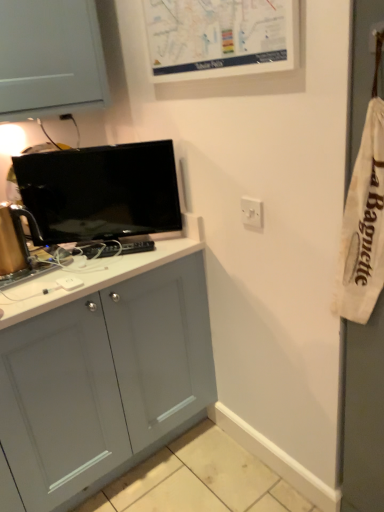
This screenshot has height=512, width=384. Identify the location of white matte map at upper center. (220, 37).

Which of these two, white plastic switch at upper right or matte black tv at upper left, stands shorter?

white plastic switch at upper right is shorter.

From the image's perspective, between white plastic switch at upper right and matte black tv at upper left, who is located below?

white plastic switch at upper right, from the image's perspective.

From a real-world perspective, is white plastic switch at upper right positioned above or below matte black tv at upper left?

white plastic switch at upper right is situated lower than matte black tv at upper left in the real world.

Between white plastic switch at upper right and matte black tv at upper left, which one appears on the right side from the viewer's perspective?

white plastic switch at upper right.

You are a GUI agent. You are given a task and a screenshot of the screen. Output one action in this format:
    pyautogui.click(x=<x>, y=<y>)
    Task: Click on the electric outlet lying below the matte black tv at upper left (from the image's perspective)
    
    Given the screenshot: What is the action you would take?
    pyautogui.click(x=252, y=211)

Is matte black tv at upper left inside the boundaries of white plastic switch at upper right, or outside?

matte black tv at upper left is spatially situated outside white plastic switch at upper right.

From a real-world perspective, is matte black tv at upper left positioned under white plastic switch at upper right based on gravity?

No, from a real-world perspective, matte black tv at upper left is not beneath white plastic switch at upper right.

In terms of width, does matte black tv at upper left look wider or thinner when compared to white plastic switch at upper right?

matte black tv at upper left is wider than white plastic switch at upper right.

Can we say white matte map at upper center lies outside matte black tv at upper left?

Yes, white matte map at upper center is not within matte black tv at upper left.

Could you tell me if white matte map at upper center is turned towards matte black tv at upper left?

No, white matte map at upper center does not turn towards matte black tv at upper left.

From the image's perspective, is white matte map at upper center located above or below matte black tv at upper left?

Based on their image positions, white matte map at upper center is located above matte black tv at upper left.

Is white matte map at upper center far away from matte black tv at upper left?

They are positioned close to each other.

Would you say matte black tv at upper left is to the left or to the right of white matte map at upper center in the picture?

In the image, matte black tv at upper left appears on the left side of white matte map at upper center.

Looking at this image, in terms of height, does matte black tv at upper left look taller or shorter compared to white matte map at upper center?

matte black tv at upper left is taller than white matte map at upper center.

Does matte black tv at upper left have a larger size compared to white matte map at upper center?

Indeed, matte black tv at upper left has a larger size compared to white matte map at upper center.

Is matte black tv at upper left facing towards white matte map at upper center?

No, matte black tv at upper left does not turn towards white matte map at upper center.

What's the angular difference between white plastic switch at upper right and white matte map at upper center's facing directions?

white plastic switch at upper right and white matte map at upper center are facing 6.92 degrees away from each other.

From a real-world perspective, is white plastic switch at upper right over white matte map at upper center?

Actually, white plastic switch at upper right is physically below white matte map at upper center in the real world.

Is white plastic switch at upper right oriented away from white matte map at upper center?

No, white plastic switch at upper right is not facing the opposite direction of white matte map at upper center.

Is white plastic switch at upper right positioned far away from white matte map at upper center?

That's not correct — white plastic switch at upper right is a little close to white matte map at upper center.

From a real-world perspective, between white matte map at upper center and white plastic switch at upper right, who is vertically higher?

white matte map at upper center.

Is white matte map at upper center located outside white plastic switch at upper right?

Yes, white matte map at upper center is outside of white plastic switch at upper right.

In the scene shown: Which point is more forward, (223,70) or (246,208)?

Positioned in front is point (223,70).

Measure the distance between white matte map at upper center and white plastic switch at upper right.

white matte map at upper center is 18.78 inches away from white plastic switch at upper right.

Identify the location of television to the left of white plastic switch at upper right. (101, 191).

Locate an element on the screen. electric outlet below the matte black tv at upper left (from a real-world perspective) is located at coordinates (252, 211).

When comparing their distances from white matte map at upper center, does white plastic switch at upper right or matte black tv at upper left seem further?

white plastic switch at upper right lies further to white matte map at upper center than the other object.

Considering their positions, is matte black tv at upper left positioned closer to white matte map at upper center than white plastic switch at upper right?

matte black tv at upper left.

Which object lies nearer to the anchor point white plastic switch at upper right, matte black tv at upper left or white matte map at upper center?

white matte map at upper center is closer to white plastic switch at upper right.

Estimate the real-world distances between objects in this image. Which object is further from matte black tv at upper left, white plastic switch at upper right or white matte map at upper center?

white plastic switch at upper right is positioned further to the anchor matte black tv at upper left.

Considering their positions, is white matte map at upper center positioned closer to white plastic switch at upper right than matte black tv at upper left?

white matte map at upper center.

When comparing their distances from matte black tv at upper left, does white matte map at upper center or white plastic switch at upper right seem closer?

white matte map at upper center is positioned closer to the anchor matte black tv at upper left.

The height and width of the screenshot is (512, 384). In order to click on electric outlet between white matte map at upper center and matte black tv at upper left along the z-axis in this screenshot , I will do `click(252, 211)`.